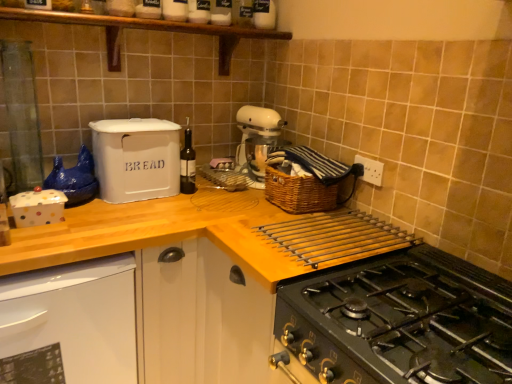
What is the approximate width of white matte mixer at center?

The width of white matte mixer at center is 16.97 centimeters.

Describe the element at coordinates (187, 165) in the screenshot. The height and width of the screenshot is (384, 512). I see `dark glass bottle at center` at that location.

Measure the distance between point (506, 345) and camera.

The depth of point (506, 345) is 38.03 inches.

The width and height of the screenshot is (512, 384). What do you see at coordinates (298, 192) in the screenshot?
I see `woven brown basket at upper right` at bounding box center [298, 192].

The height and width of the screenshot is (384, 512). Identify the location of white glossy dishwasher at lower left. pyautogui.click(x=70, y=324).

What do you see at coordinates (244, 299) in the screenshot? The height and width of the screenshot is (384, 512). I see `wooden at upper center` at bounding box center [244, 299].

Image resolution: width=512 pixels, height=384 pixels. What do you see at coordinates (147, 29) in the screenshot? I see `wooden shelf at upper center` at bounding box center [147, 29].

This screenshot has width=512, height=384. In order to click on white matte mixer at center in this screenshot , I will do `click(257, 141)`.

Would you say wooden shelf at upper center is a long distance from white matte bread bin at upper left?

No, wooden shelf at upper center is not far away from white matte bread bin at upper left.

Between wooden shelf at upper center and white matte bread bin at upper left, which one is positioned in front?

Positioned in front is wooden shelf at upper center.

From their relative heights in the image, would you say wooden shelf at upper center is taller or shorter than white matte bread bin at upper left?

wooden shelf at upper center is shorter than white matte bread bin at upper left.

Measure the distance from white matte bread bin at upper left to woven brown basket at upper right.

The distance of white matte bread bin at upper left from woven brown basket at upper right is 20.74 inches.

How many degrees apart are the facing directions of white matte bread bin at upper left and woven brown basket at upper right?

The facing directions of white matte bread bin at upper left and woven brown basket at upper right are 89.4 degrees apart.

Which object is closer to the camera taking this photo, white matte bread bin at upper left or woven brown basket at upper right?

white matte bread bin at upper left.

Consider the image. Which is less distant, (134, 157) or (279, 188)?

The point (134, 157) is in front.

Is dark glass bottle at center closer to the viewer compared to woven brown basket at upper right?

That is False.

How many degrees apart are the facing directions of dark glass bottle at center and woven brown basket at upper right?

There is a 89.4-degree angle between the facing directions of dark glass bottle at center and woven brown basket at upper right.

Can you confirm if dark glass bottle at center is taller than woven brown basket at upper right?

Correct, dark glass bottle at center is much taller as woven brown basket at upper right.

Where is `dish washer located on the left of dark glass bottle at center`? The height and width of the screenshot is (384, 512). dish washer located on the left of dark glass bottle at center is located at coordinates tap(70, 324).

Between point (26, 346) and point (186, 132), which one is positioned behind?

The point (186, 132) is behind.

Based on the photo, between wooden shelf at upper center and wooden at upper center, which one is positioned behind?

wooden shelf at upper center.

Measure the distance between wooden shelf at upper center and wooden at upper center.

A distance of 1.08 meters exists between wooden shelf at upper center and wooden at upper center.

Is wooden shelf at upper center shorter than wooden at upper center?

Yes, wooden shelf at upper center is shorter than wooden at upper center.

From a real-world perspective, is wooden shelf at upper center physically located above or below wooden at upper center?

wooden shelf at upper center is situated higher than wooden at upper center in the real world.

Between wooden at upper center and black matte gas stove at lower right, which one appears on the right side from the viewer's perspective?

Positioned to the right is black matte gas stove at lower right.

From a real-world perspective, which object rests below the other?

From a 3D spatial view, wooden at upper center is below.

Looking at this image, would you say wooden at upper center is inside or outside black matte gas stove at lower right?

The correct answer is: outside.

Considering the sizes of objects wooden at upper center and black matte gas stove at lower right in the image provided, who is shorter, wooden at upper center or black matte gas stove at lower right?

With less height is black matte gas stove at lower right.

Based on the photo, is wooden shelf at upper center bigger or smaller than white glossy dishwasher at lower left?

Considering their sizes, wooden shelf at upper center takes up less space than white glossy dishwasher at lower left.

Based on their positions, is wooden shelf at upper center located to the left or right of white glossy dishwasher at lower left?

Clearly, wooden shelf at upper center is on the right of white glossy dishwasher at lower left in the image.

From a real-world perspective, between wooden shelf at upper center and white glossy dishwasher at lower left, who is vertically higher?

wooden shelf at upper center, from a real-world perspective.

Locate an element on the screen. This screenshot has width=512, height=384. kitchen appliance that appears below the wooden shelf at upper center (from a real-world perspective) is located at coordinates (136, 158).

I want to click on kitchen appliance above the woven brown basket at upper right (from the image's perspective), so pos(136,158).

Based on their spatial positions, is white glossy dishwasher at lower left or woven brown basket at upper right further from wooden shelf at upper center?

Among the two, white glossy dishwasher at lower left is located further to wooden shelf at upper center.

Considering their positions, is white matte bread bin at upper left positioned closer to wooden at upper center than wooden shelf at upper center?

Among the two, white matte bread bin at upper left is located nearer to wooden at upper center.

Looking at the image, which one is located further to woven brown basket at upper right, black matte gas stove at lower right or white matte mixer at center?

Among the two, black matte gas stove at lower right is located further to woven brown basket at upper right.

Estimate the real-world distances between objects in this image. Which object is further from white glossy dishwasher at lower left, wooden at upper center or dark glass bottle at center?

Among the two, dark glass bottle at center is located further to white glossy dishwasher at lower left.

Estimate the real-world distances between objects in this image. Which object is closer to woven brown basket at upper right, white glossy dishwasher at lower left or wooden at upper center?

Based on the image, wooden at upper center appears to be nearer to woven brown basket at upper right.

Considering their positions, is wooden shelf at upper center positioned closer to woven brown basket at upper right than white matte mixer at center?

The object closer to woven brown basket at upper right is white matte mixer at center.

Looking at the image, which one is located closer to white glossy dishwasher at lower left, white matte bread bin at upper left or white matte mixer at center?

white matte bread bin at upper left is positioned closer to the anchor white glossy dishwasher at lower left.

Estimate the real-world distances between objects in this image. Which object is closer to white glossy dishwasher at lower left, wooden shelf at upper center or dark glass bottle at center?

dark glass bottle at center.

At what (x,y) coordinates should I click in order to perform the action: click on bottle between white matte mixer at center and white glossy dishwasher at lower left from top to bottom. Please return your answer as a coordinate pair (x, y). The width and height of the screenshot is (512, 384). Looking at the image, I should click on (187, 165).

Identify the location of mixer between wooden shelf at upper center and white glossy dishwasher at lower left vertically. This screenshot has width=512, height=384. (257, 141).

Locate an element on the screen. kitchen appliance located between black matte gas stove at lower right and dark glass bottle at center in the depth direction is located at coordinates (136, 158).

This screenshot has height=384, width=512. Identify the location of kitchen appliance between wooden at upper center and white matte mixer at center along the z-axis. (136, 158).